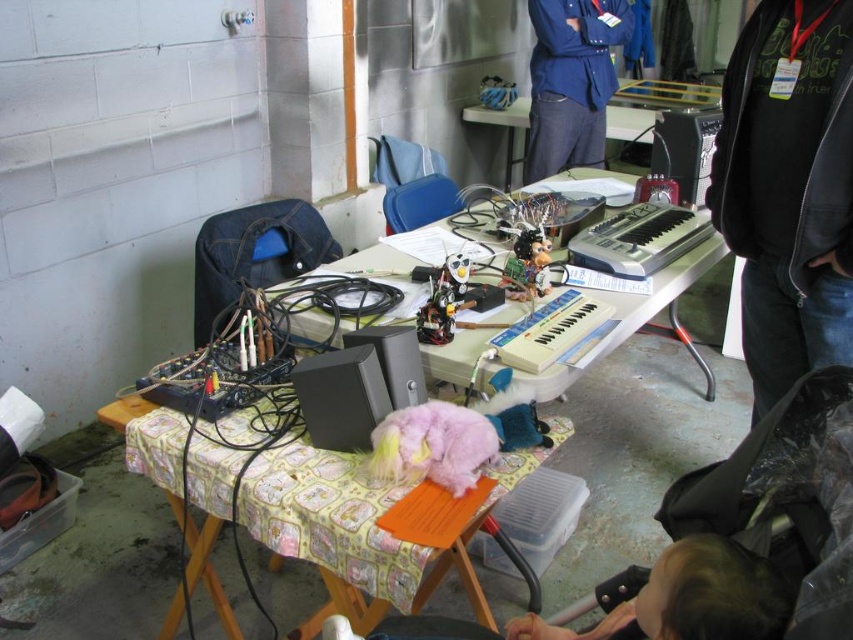
Is black fleece jacket at upper right thinner than fuzzy pink plushie at center?

Correct, black fleece jacket at upper right's width is less than fuzzy pink plushie at center's.

How distant is black fleece jacket at upper right from fuzzy pink plushie at center?

93.52 centimeters

In order to click on black fleece jacket at upper right in this screenshot , I will do `click(788, 188)`.

This screenshot has height=640, width=853. I want to click on black fleece jacket at upper right, so click(x=788, y=188).

Is light brown hair at lower center to the right of blue denim shirt at upper center from the viewer's perspective?

In fact, light brown hair at lower center is to the left of blue denim shirt at upper center.

Does point (712, 545) lie in front of point (619, 12)?

Yes, point (712, 545) is closer to viewer.

Locate an element on the screen. light brown hair at lower center is located at coordinates (689, 598).

Between black fleece jacket at upper right and white plastic table at center, which one is positioned higher?

white plastic table at center is above.

Is black fleece jacket at upper right below white plastic table at center?

Yes, black fleece jacket at upper right is below white plastic table at center.

At what (x,y) coordinates should I click in order to perform the action: click on black fleece jacket at upper right. Please return your answer as a coordinate pair (x, y). The image size is (853, 640). Looking at the image, I should click on (788, 188).